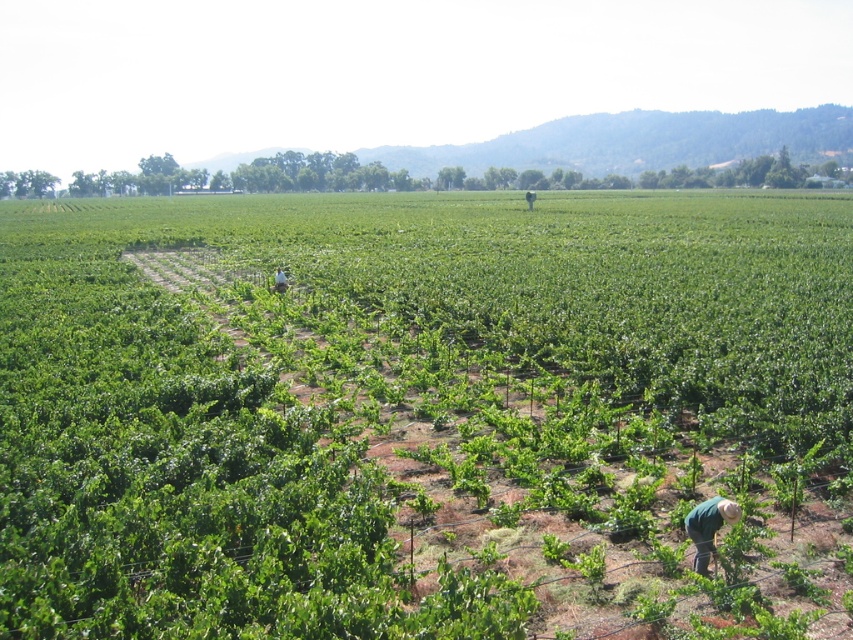
Who is taller, green leafy plants at center or green fabric at center?

With more height is green leafy plants at center.

The width and height of the screenshot is (853, 640). I want to click on green leafy plants at center, so click(x=424, y=416).

Between green fabric at lower right and green fabric at center, which one appears on the right side from the viewer's perspective?

green fabric at lower right

Between green fabric at lower right and green fabric at center, which one has less height?

green fabric at center is shorter.

Is point (717, 522) in front of point (277, 276)?

Yes, it is.

Locate an element on the screen. The image size is (853, 640). green fabric at lower right is located at coordinates (708, 528).

Between green leafy plants at center and green fabric at lower right, which one is positioned lower?

green fabric at lower right is below.

Between point (415, 442) and point (721, 500), which one is positioned in front?

Point (721, 500)

Does point (608, 410) lie in front of point (695, 563)?

No, it is behind (695, 563).

I want to click on green leafy plants at center, so click(424, 416).